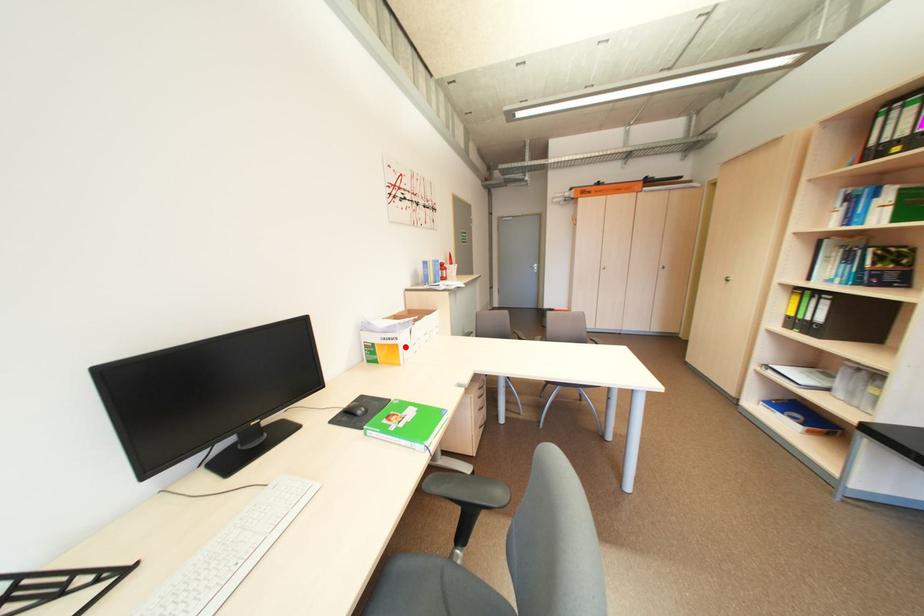
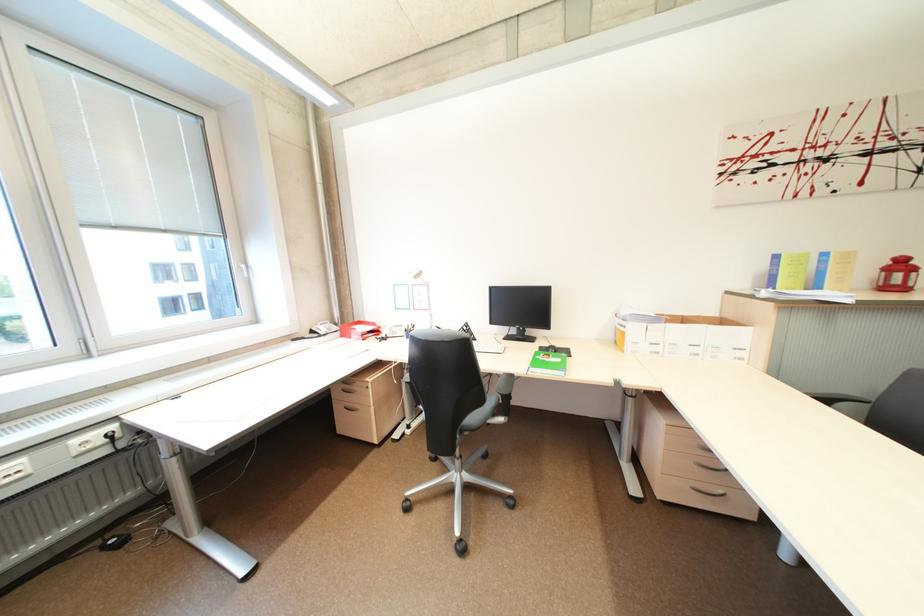
Locate, in the second image, the point that corresponds to the highlighted location in the first image.

(633, 334)